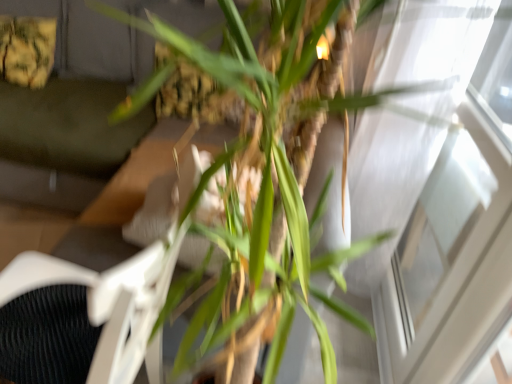
The height and width of the screenshot is (384, 512). What are the coordinates of `dark gray fabric couch at upper left` in the screenshot? It's located at (74, 95).

What is the approximate height of green leafy plant at center?

4.40 feet.

You are a GUI agent. You are given a task and a screenshot of the screen. Output one action in this format:
    pyautogui.click(x=<x>, y=<y>)
    Task: Click on the dark gray fabric couch at upper left
    The width and height of the screenshot is (512, 384).
    Given the screenshot: What is the action you would take?
    pyautogui.click(x=74, y=95)

In the image, is dark gray fabric couch at upper left on the left side or the right side of white textured swivel chair at center?

dark gray fabric couch at upper left is to the left of white textured swivel chair at center.

Between dark gray fabric couch at upper left and white textured swivel chair at center, which one has less height?

white textured swivel chair at center is shorter.

From a real-world perspective, which is physically below, dark gray fabric couch at upper left or white textured swivel chair at center?

white textured swivel chair at center.

Which of these two, dark gray fabric couch at upper left or white textured swivel chair at center, is smaller?

white textured swivel chair at center is smaller.

Looking at this image, is transparent glass window at upper right outside of white textured swivel chair at center?

That's correct, transparent glass window at upper right is outside of white textured swivel chair at center.

Does transparent glass window at upper right have a greater width compared to white textured swivel chair at center?

Incorrect, the width of transparent glass window at upper right does not surpass that of white textured swivel chair at center.

Considering the positions of points (375, 140) and (45, 301), is point (375, 140) farther from camera compared to point (45, 301)?

That is True.

Which object is positioned more to the left, white textured swivel chair at center or dark gray fabric couch at upper left?

dark gray fabric couch at upper left is more to the left.

Does white textured swivel chair at center have a larger size compared to dark gray fabric couch at upper left?

Actually, white textured swivel chair at center might be smaller than dark gray fabric couch at upper left.

Is white textured swivel chair at center touching dark gray fabric couch at upper left?

No, white textured swivel chair at center is not touching dark gray fabric couch at upper left.

Is point (118, 356) positioned after point (387, 88)?

No, it is in front of (387, 88).

Is white textured swivel chair at center taller or shorter than green leafy plant at center?

white textured swivel chair at center is shorter than green leafy plant at center.

Does white textured swivel chair at center turn towards green leafy plant at center?

No, white textured swivel chair at center is not oriented towards green leafy plant at center.

Measure the distance between white textured swivel chair at center and green leafy plant at center.

A distance of 11.35 inches exists between white textured swivel chair at center and green leafy plant at center.

From a real-world perspective, is green leafy plant at center positioned above or below dark gray fabric couch at upper left?

From a real-world perspective, green leafy plant at center is physically above dark gray fabric couch at upper left.

Could you tell me if green leafy plant at center is turned towards dark gray fabric couch at upper left?

No, green leafy plant at center is not facing towards dark gray fabric couch at upper left.

From the image's perspective, is green leafy plant at center above or below dark gray fabric couch at upper left?

green leafy plant at center is below dark gray fabric couch at upper left.

Is transparent glass window at upper right shorter than dark gray fabric couch at upper left?

Incorrect, the height of transparent glass window at upper right does not fall short of that of dark gray fabric couch at upper left.

The height and width of the screenshot is (384, 512). What are the coordinates of `couch below the transparent glass window at upper right (from a real-world perspective)` in the screenshot? It's located at (74, 95).

Considering the sizes of objects transparent glass window at upper right and dark gray fabric couch at upper left in the image provided, who is bigger, transparent glass window at upper right or dark gray fabric couch at upper left?

Bigger between the two is dark gray fabric couch at upper left.

Which is correct: transparent glass window at upper right is inside dark gray fabric couch at upper left, or outside of it?

transparent glass window at upper right cannot be found inside dark gray fabric couch at upper left.

Which object is positioned more to the right, green leafy plant at center or transparent glass window at upper right?

Positioned to the right is transparent glass window at upper right.

Is green leafy plant at center positioned far away from transparent glass window at upper right?

No, green leafy plant at center is not far from transparent glass window at upper right.

Find the location of a particular element. Image resolution: width=512 pixels, height=384 pixels. houseplant above the transparent glass window at upper right (from a real-world perspective) is located at coordinates (264, 147).

Identify the location of swivel chair on the right of dark gray fabric couch at upper left. (85, 316).

Identify the location of swivel chair that appears below the transparent glass window at upper right (from the image's perspective). This screenshot has height=384, width=512. (85, 316).

When comparing their distances from transparent glass window at upper right, does dark gray fabric couch at upper left or green leafy plant at center seem further?

dark gray fabric couch at upper left lies further to transparent glass window at upper right than the other object.

Considering their positions, is dark gray fabric couch at upper left positioned closer to transparent glass window at upper right than white textured swivel chair at center?

white textured swivel chair at center is closer to transparent glass window at upper right.

Considering their positions, is green leafy plant at center positioned closer to white textured swivel chair at center than transparent glass window at upper right?

green leafy plant at center is positioned closer to the anchor white textured swivel chair at center.

Which object lies nearer to the anchor point dark gray fabric couch at upper left, green leafy plant at center or white textured swivel chair at center?

white textured swivel chair at center is closer to dark gray fabric couch at upper left.

Looking at the image, which one is located further to dark gray fabric couch at upper left, transparent glass window at upper right or white textured swivel chair at center?

transparent glass window at upper right.

Based on the photo, looking at the image, which one is located further to white textured swivel chair at center, transparent glass window at upper right or green leafy plant at center?

transparent glass window at upper right is further to white textured swivel chair at center.

Estimate the real-world distances between objects in this image. Which object is closer to transparent glass window at upper right, white textured swivel chair at center or green leafy plant at center?

green leafy plant at center.

Looking at the image, which one is located closer to green leafy plant at center, dark gray fabric couch at upper left or transparent glass window at upper right?

Among the two, transparent glass window at upper right is located nearer to green leafy plant at center.

Locate an element on the screen. The image size is (512, 384). houseplant between dark gray fabric couch at upper left and transparent glass window at upper right in the horizontal direction is located at coordinates (264, 147).

This screenshot has height=384, width=512. I want to click on swivel chair located between green leafy plant at center and dark gray fabric couch at upper left in the depth direction, so click(x=85, y=316).

Image resolution: width=512 pixels, height=384 pixels. Find the location of `swivel chair situated between dark gray fabric couch at upper left and transparent glass window at upper right from left to right`. swivel chair situated between dark gray fabric couch at upper left and transparent glass window at upper right from left to right is located at coordinates (85, 316).

You are a GUI agent. You are given a task and a screenshot of the screen. Output one action in this format:
    pyautogui.click(x=<x>, y=<y>)
    Task: Click on the houseplant between white textured swivel chair at center and transparent glass window at upper right in the horizontal direction
    
    Given the screenshot: What is the action you would take?
    pyautogui.click(x=264, y=147)